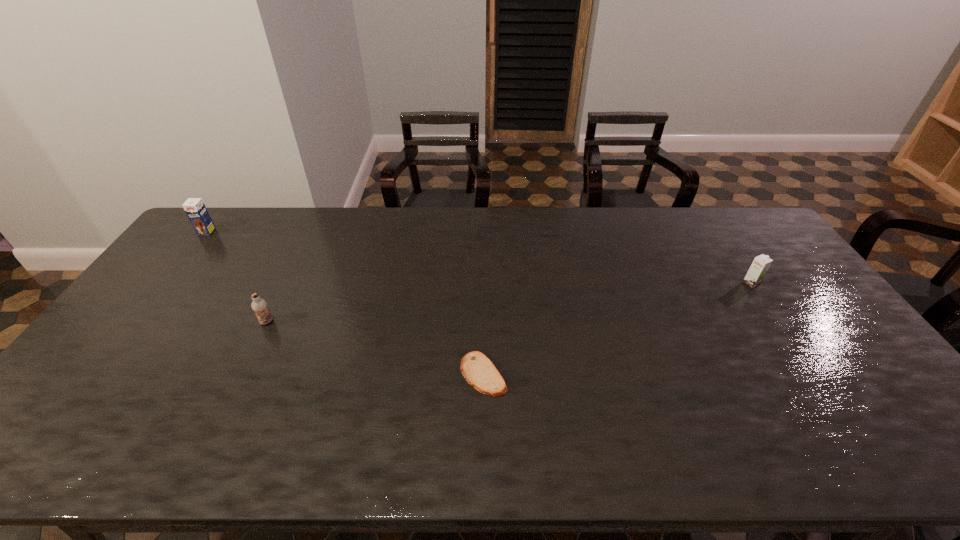
The width and height of the screenshot is (960, 540). In the image, there is a desktop. In order to click on vacant space at the far right corner in this screenshot , I will do `click(742, 208)`.

What are the coordinates of `free spot between the rightmost chocolate milk and the nearest object` in the screenshot? It's located at (617, 329).

Where is `empty space between the leftmost object and the second nearest object`? Image resolution: width=960 pixels, height=540 pixels. empty space between the leftmost object and the second nearest object is located at coordinates (237, 277).

The height and width of the screenshot is (540, 960). In order to click on empty space between the second nearest object and the tallest chocolate milk in this screenshot , I will do `click(237, 277)`.

The height and width of the screenshot is (540, 960). In order to click on vacant area that lies between the rightmost object and the farthest chocolate milk in this screenshot , I will do `click(479, 258)`.

Identify the location of free space between the third nearest object and the farthest object. (479, 258).

Identify the location of free point between the third object from left to right and the nearest chocolate milk. (375, 348).

Locate an element on the screen. The image size is (960, 540). vacant region between the second chocolate milk from right to left and the shortest object is located at coordinates (375, 348).

Locate an element on the screen. free space between the pita bread and the third farthest object is located at coordinates (375, 348).

The width and height of the screenshot is (960, 540). In order to click on vacant space that is in between the pita bread and the third farthest object in this screenshot , I will do `click(375, 348)`.